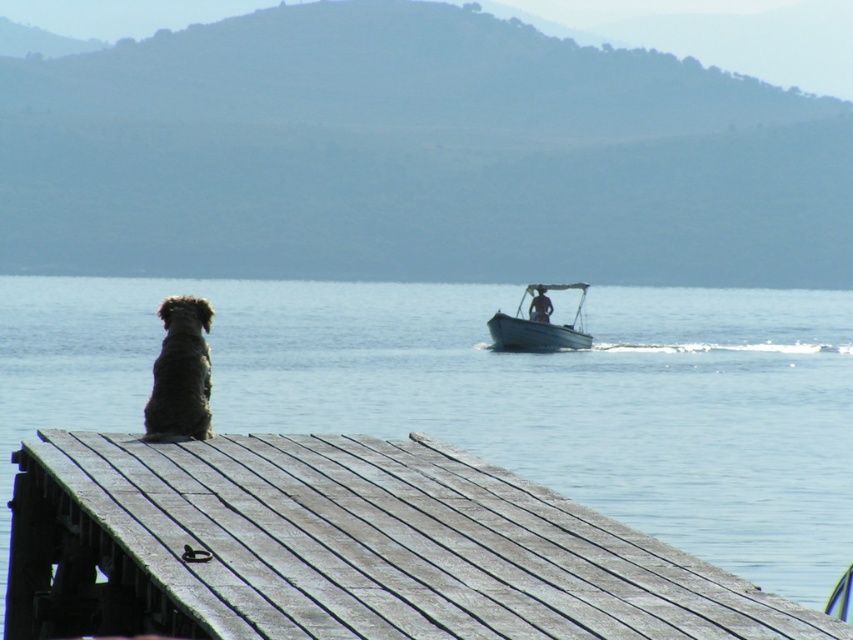
You are planning to take a photo of the fuzzy brown dog at left and the white plastic boat at center. Since the dog is smaller, will it appear smaller in the photo compared to the boat?

The fuzzy brown dog at left has a smaller width than the white plastic boat at center, so yes, it will appear smaller in the photo.

You are standing on the weathered wood dock at lower left and want to see the fuzzy brown dog at left. In which direction should you look?

The weathered wood dock at lower left is to the right of fuzzy brown dog at left, so you should look to the left to see the fuzzy brown dog at left.